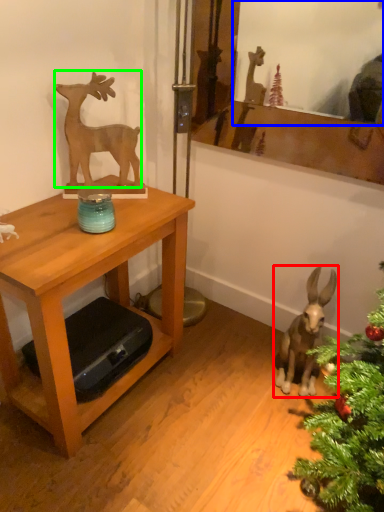
Question: Which object is positioned closest to animal (highlighted by a red box)? Select from mirror (highlighted by a blue box) and deer (highlighted by a green box).

Choices:
 (A) mirror
 (B) deer

Answer: (B)